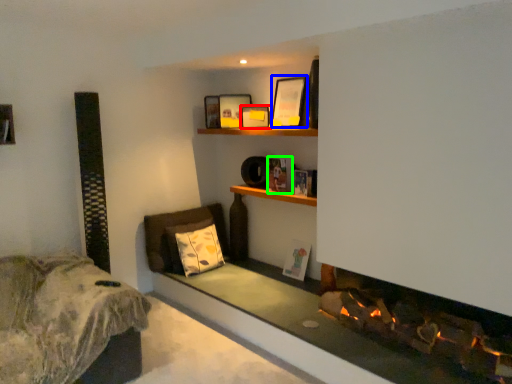
Question: Based on their relative distances, which object is farther from picture frame (highlighted by a red box)? Choose from picture frame (highlighted by a blue box) and book (highlighted by a green box).

Choices:
 (A) picture frame
 (B) book

Answer: (B)